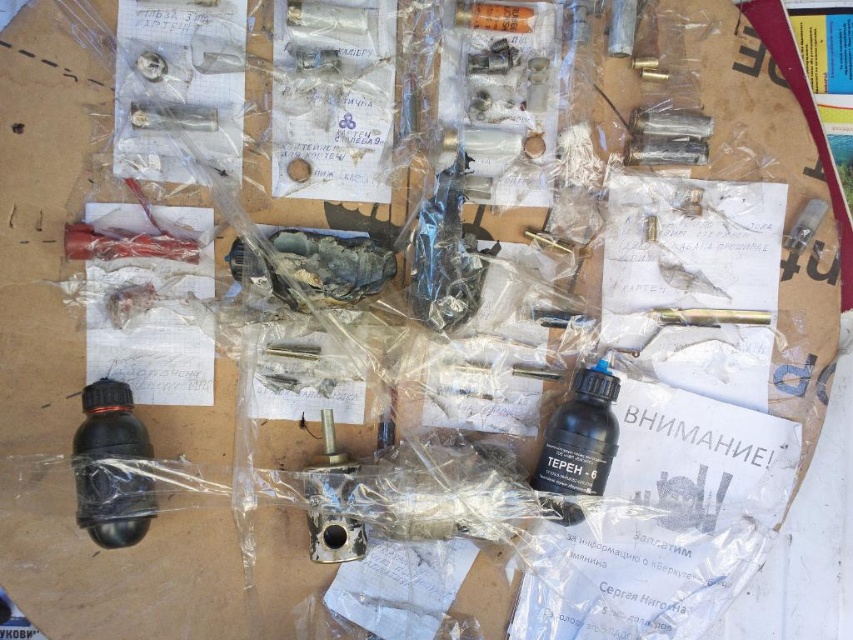
Question: Is black matte bottle at lower left to the right of black matte bottle at center from the viewer's perspective?

Choices:
 (A) no
 (B) yes

Answer: (A)

Question: Which point is closer to the camera?

Choices:
 (A) (88, 516)
 (B) (596, 381)

Answer: (A)

Question: Which point is farther from the camera taking this photo?

Choices:
 (A) (543, 445)
 (B) (97, 432)

Answer: (A)

Question: Can you confirm if black matte bottle at lower left is positioned below black matte bottle at center?

Choices:
 (A) no
 (B) yes

Answer: (B)

Question: Which object is farther from the camera taking this photo?

Choices:
 (A) black matte bottle at center
 (B) black matte bottle at lower left

Answer: (A)

Question: Considering the relative positions of black matte bottle at lower left and black matte bottle at center in the image provided, where is black matte bottle at lower left located with respect to black matte bottle at center?

Choices:
 (A) left
 (B) right

Answer: (A)